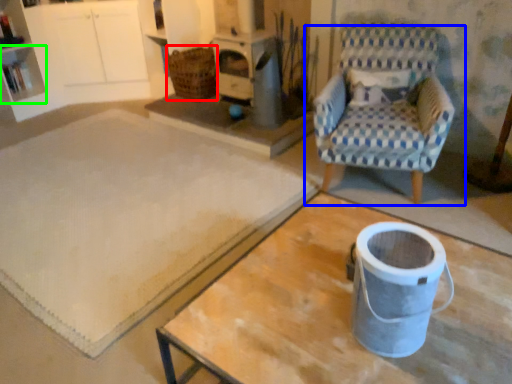
Question: Which is nearer to the basket (highlighted by a red box)? chair (highlighted by a blue box) or shelf (highlighted by a green box).

Choices:
 (A) chair
 (B) shelf

Answer: (B)